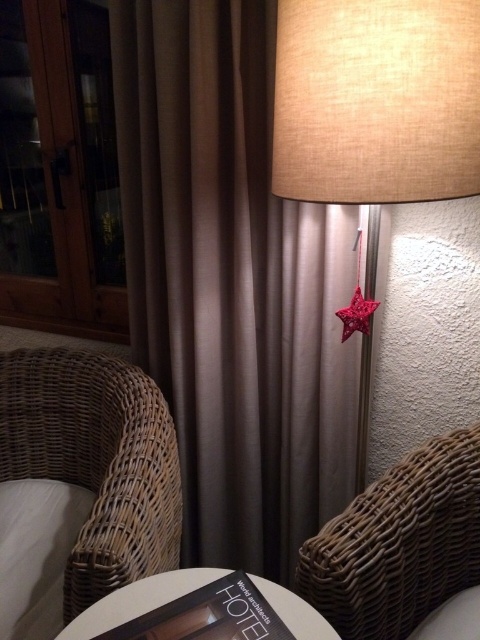
You are sitting in the brown wicker armchair at lower right and want to grab the white soft pillow at lower left. Based on their positions, can you reach it without moving your chair?

The brown wicker armchair at lower right is closer to the viewer than the white soft pillow at lower left, so you would need to stretch or move forward to reach the pillow since it is farther away.

You are standing in the living room and want to place a new lamp on the table in front of the wicker chair. The lamp has a beige fabric lampshade. Where should you place it to match the existing beige fabric lampshade at center?

The beige fabric lampshade at center is located at point (376, 104), so you should place the new lamp at the same coordinates to match its position.